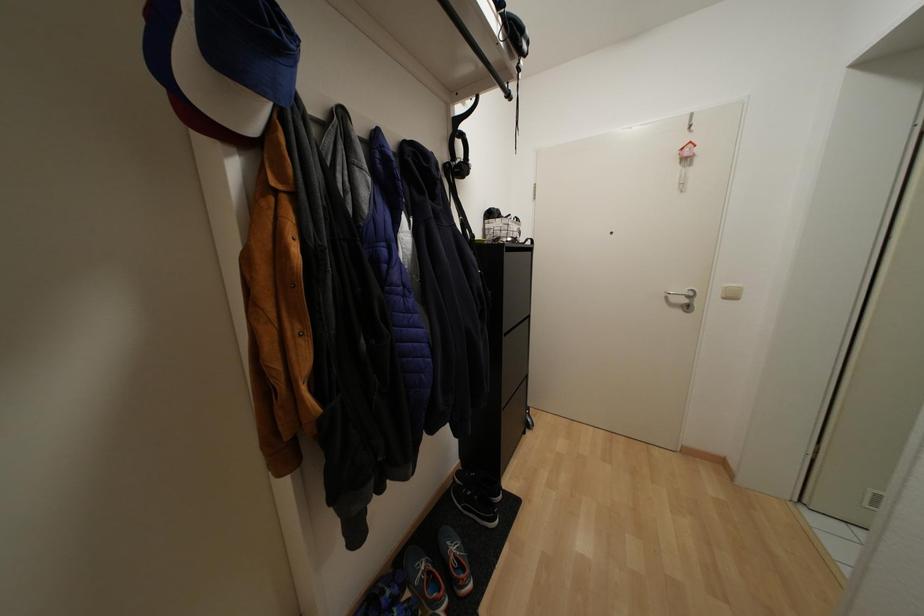
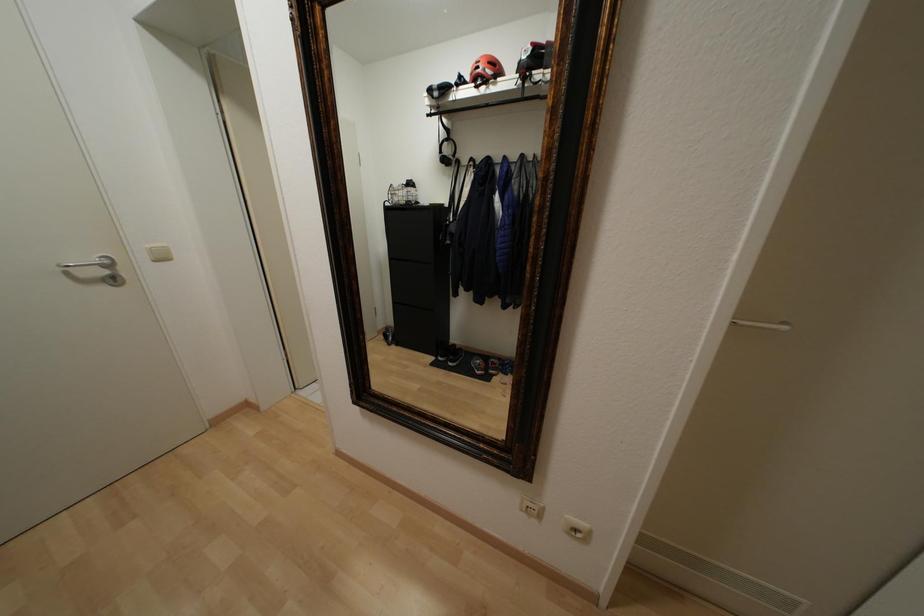
First-person continuous shooting, in which direction is the camera rotating?

The camera's rotation is toward right-down.